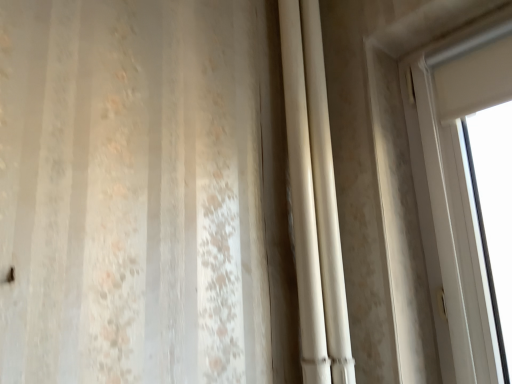
This screenshot has width=512, height=384. What do you see at coordinates (314, 199) in the screenshot?
I see `white matte curtain at center` at bounding box center [314, 199].

Identify the location of white matte curtain at center. (314, 199).

This screenshot has width=512, height=384. In order to click on white matte curtain at center in this screenshot , I will do `click(314, 199)`.